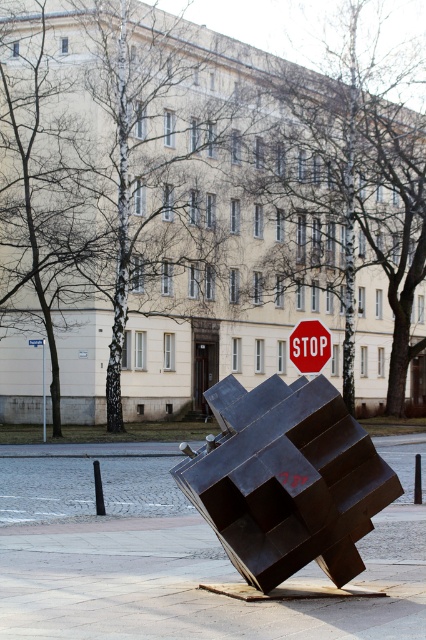
You are a pedestrian standing at the base of the sculpture. Looking up, you see the red plastic stop sign at upper center and the metallic street sign at upper left. Which sign is higher in the scene?

The red plastic stop sign at upper center is higher than the metallic street sign at upper left.

You are a city planner analyzing the placement of traffic signs in an urban area. You observe the red plastic stop sign at upper center in the image. Based on its coordinates, can you determine if it is positioned correctly according to standard traffic sign placement guidelines which require stop signs to be placed at least 1.5 meters above the ground and clearly visible from a distance of 30 meters?

The coordinates of the red plastic stop sign at upper center are given as point (310, 346). However, without knowing the actual height and visibility distance from these coordinates, we cannot definitively determine if it meets the standard placement guidelines. Further measurements would be needed to confirm compliance.

You are a pedestrian standing on the sidewalk looking at the urban scene. You notice the metallic street sign at upper left and the red stop sign at center. Which object is positioned lower in the image?

The metallic street sign at upper left is below the red stop sign at center, so it is positioned lower in the image.